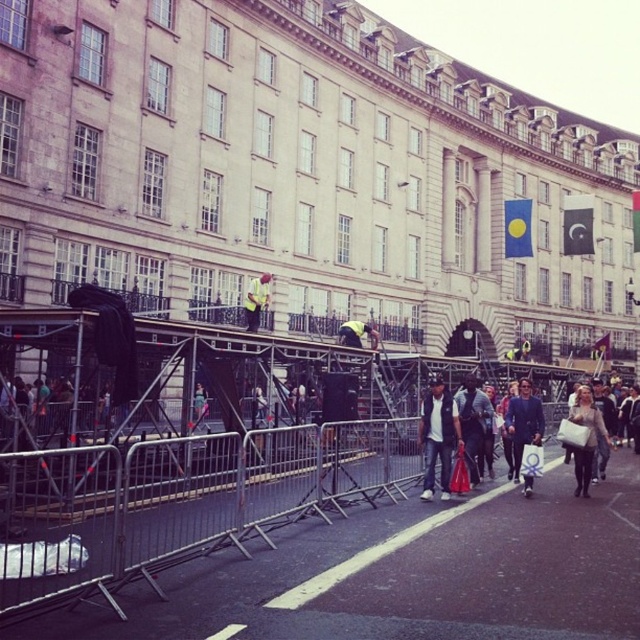
You are a pedestrian standing on the street in front of the classical building. You see a dark blue suit at center and a yellow fabric at center. Which object is larger?

The dark blue suit at center is bigger than the yellow fabric at center.

You are standing at the bottom of the building in the urban scene. You need to place a new decorative plant pot exactly where the matte black backpack at center is currently located. What are the coordinates where you should place the plant pot?

The coordinates for placing the plant pot should be at point (474, 428), which is where the matte black backpack at center is located.